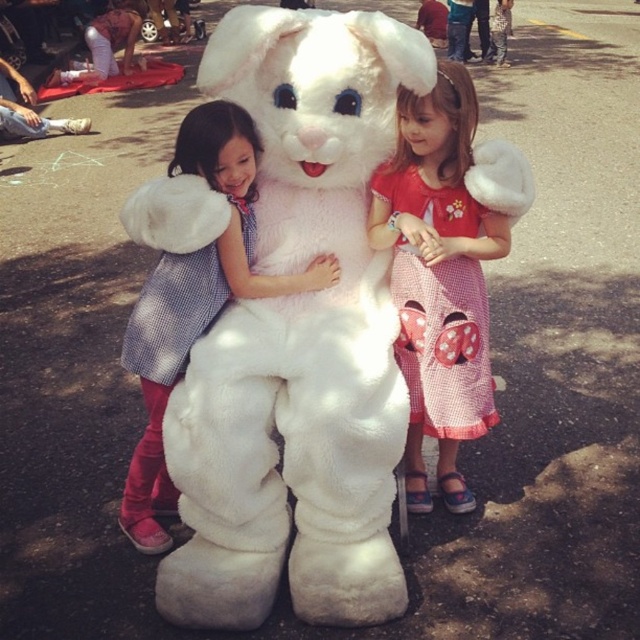
Consider the image. Which of these two, fluffy white bunny at center or velvety white coat at center, stands taller?

With more height is fluffy white bunny at center.

Who is positioned more to the right, fluffy white bunny at center or velvety white coat at center?

fluffy white bunny at center

This screenshot has width=640, height=640. What do you see at coordinates (298, 339) in the screenshot?
I see `fluffy white bunny at center` at bounding box center [298, 339].

Identify the location of fluffy white bunny at center. Image resolution: width=640 pixels, height=640 pixels. (298, 339).

Which is in front, point (266, 289) or point (452, 301)?

Point (266, 289)

Is velvety white coat at center bigger than red checkered dress with bow at center?

Yes, velvety white coat at center is bigger than red checkered dress with bow at center.

Is point (160, 342) positioned before point (470, 285)?

That is True.

Identify the location of velvety white coat at center. (195, 300).

Based on the photo, between fluffy white bunny at center and red checkered dress with bow at center, which one has less height?

red checkered dress with bow at center is shorter.

The width and height of the screenshot is (640, 640). Find the location of `fluffy white bunny at center`. fluffy white bunny at center is located at coordinates (298, 339).